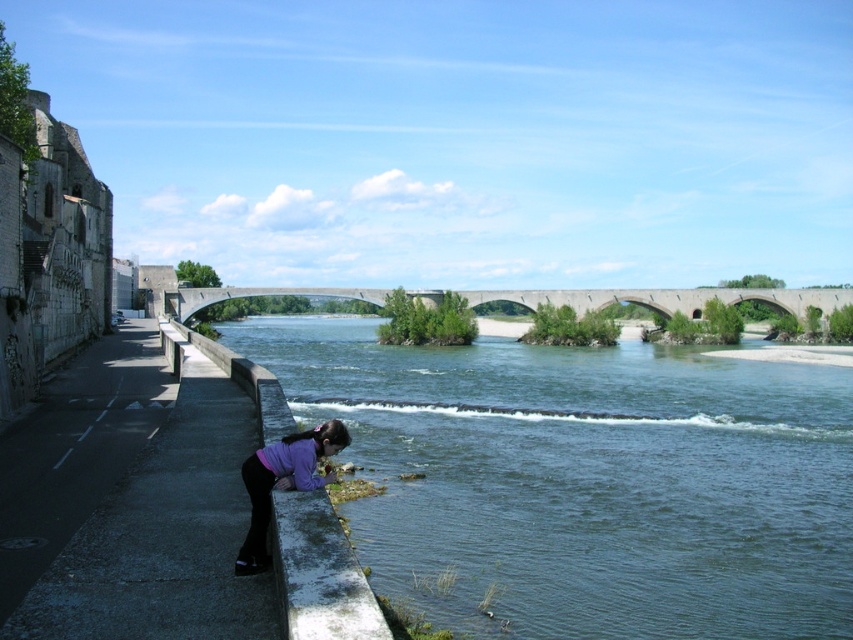
Question: Can you confirm if greenish-blue water at center is thinner than purple matte shirt at lower center?

Choices:
 (A) yes
 (B) no

Answer: (B)

Question: Which point is closer to the camera taking this photo?

Choices:
 (A) (273, 476)
 (B) (459, 355)

Answer: (A)

Question: Does greenish-blue water at center appear over concrete bridge at center?

Choices:
 (A) yes
 (B) no

Answer: (B)

Question: Which object is the closest to the greenish-blue water at center?

Choices:
 (A) purple matte shirt at lower center
 (B) concrete bridge at center

Answer: (A)

Question: Considering the relative positions of greenish-blue water at center and concrete bridge at center in the image provided, where is greenish-blue water at center located with respect to concrete bridge at center?

Choices:
 (A) right
 (B) left

Answer: (B)

Question: Which point is farther to the camera?

Choices:
 (A) concrete bridge at center
 (B) purple matte shirt at lower center
 (C) greenish-blue water at center

Answer: (A)